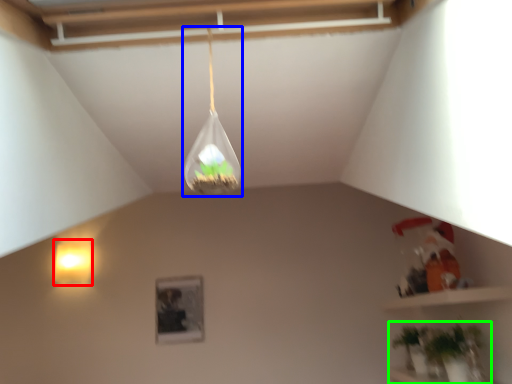
Question: Which object is positioned farthest from lamp (highlighted by a red box)? Select from lamp (highlighted by a blue box) and houseplant (highlighted by a green box).

Choices:
 (A) lamp
 (B) houseplant

Answer: (A)